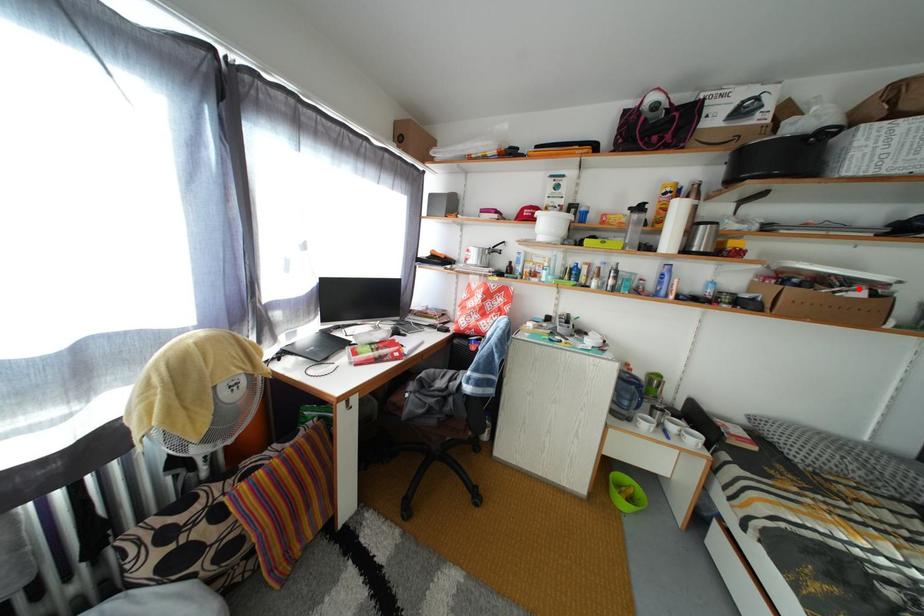
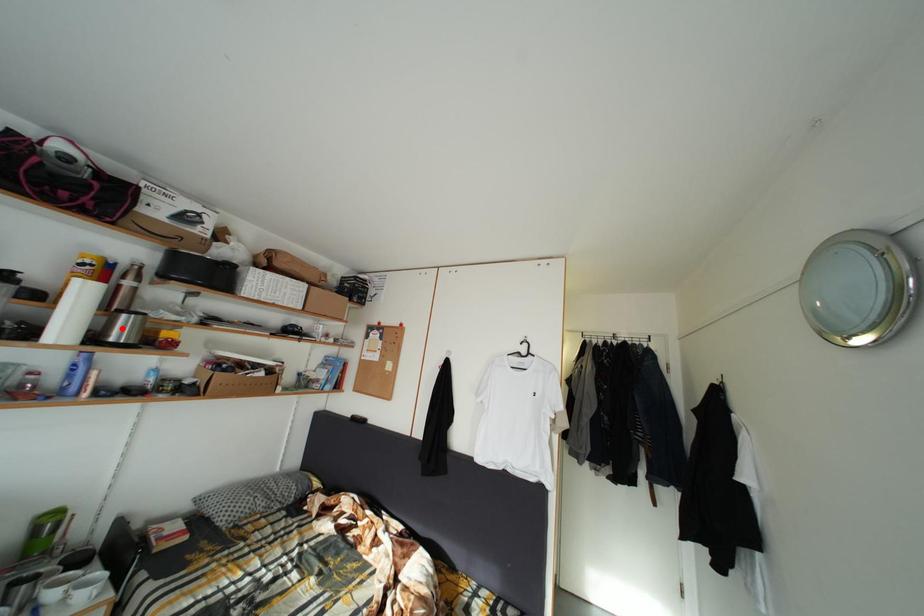
I am providing you with two images of the same scene from different viewpoints. A red point is marked on the first image and another point is marked on the second image. Is the red point in image1 aligned with the point shown in image2?

No